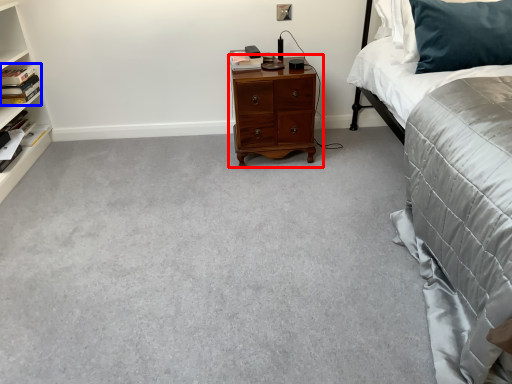
Question: Which of the following is the closest to the observer, nightstand (highlighted by a red box) or book (highlighted by a blue box)?

Choices:
 (A) nightstand
 (B) book

Answer: (A)